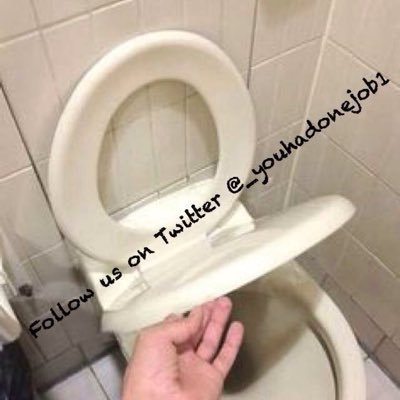
This screenshot has height=400, width=400. I want to click on white tiled floor, so click(x=78, y=387).